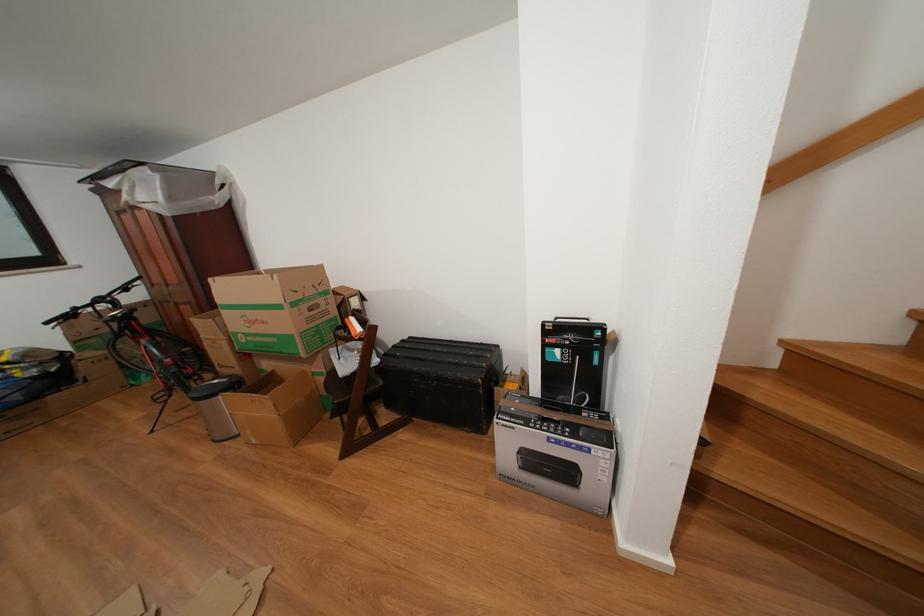
What do you see at coordinates (118, 321) in the screenshot? I see `the bicycle handlebar grip` at bounding box center [118, 321].